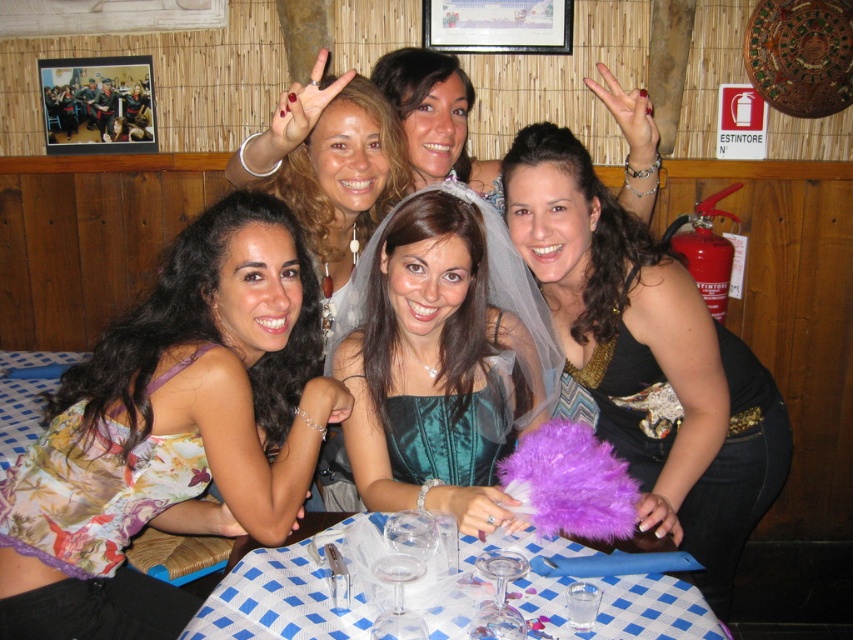
You are taking a photo of the group and want to focus on both the point at coordinates point [299,472] and point [373,449]. Which point should you adjust your focus to first to ensure both are in sharp view?

Point [299,472] is closer to the camera than point [373,449], so you should focus on point [299,472] first to ensure both points are in sharp view.

You are a photographer at the event and need to capture a closeup shot of both the shiny black dress at center and the matte white veil at center. Your camera has a maximum focus range of 20 inches. Can you fit both subjects within the camera focus range?

The shiny black dress at center is 22.04 inches from the matte white veil at center, which exceeds the camera focus range of 20 inches. Therefore, you cannot fit both subjects within the camera focus range.

You are a photographer at the event and need to position a spotlight on the shiny black dress at center without shining it on the matte white veil at center. Based on their positions, is this possible?

The shiny black dress at center is below the matte white veil at center, so positioning a spotlight directly on the dress while avoiding the veil above it is feasible.